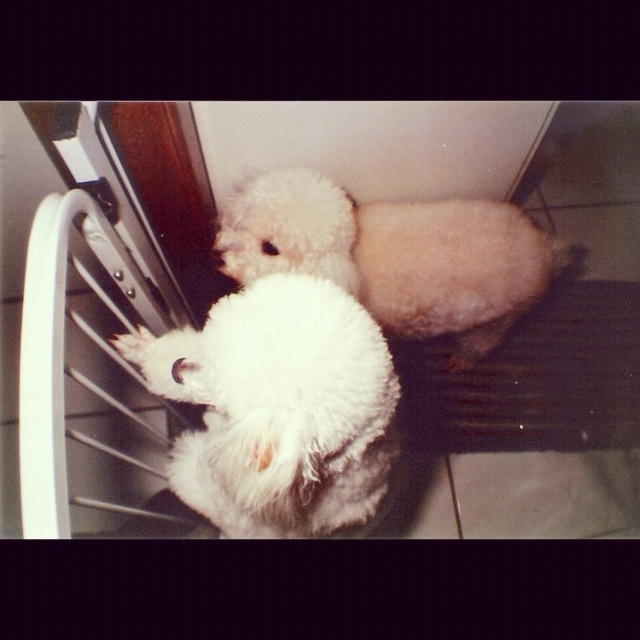
You are standing in a kitchen and see the white fluffy dog at left. If you want to place a treat bowl exactly where the dog is currently standing, what are the coordinates you should input into the robotic feeding system?

The coordinates for the white fluffy dog at left are at point (280, 410), so you should input those coordinates into the robotic feeding system.

You are a dog trainer who needs to separate two dogs using a divider that is 20 inches wide. The dogs are the white fluffy dog at center and the white fluffy paw at lower left. Can the divider fit between them without touching either dog?

The distance between the white fluffy dog at center and the white fluffy paw at lower left is 21.53 inches. Since the divider is 20 inches wide, there is enough space between them to place the divider without touching either dog.

You are a dog trainer observing two white fluffy dogs in a kitchen. You see the white fluffy dog at center and the white fluffy paw at lower left. Which dog is positioned to the right of the other?

The white fluffy dog at center is positioned to the right of the white fluffy paw at lower left.